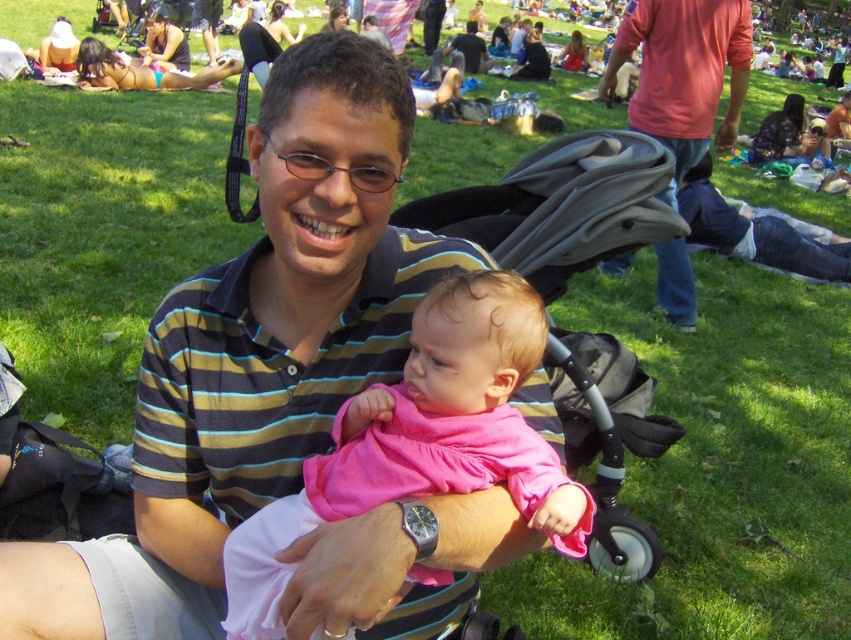
You need to place a small sticker on either the pink fabric baby at center or the matte pink shirt at upper right. Which object would you choose to ensure the sticker is visible without overlapping the other object?

The pink fabric baby at center has a larger width than the matte pink shirt at upper right, so placing the sticker on the pink fabric baby at center would ensure visibility without overlapping the matte pink shirt at upper right.

You are a photographer trying to capture a clear shot of the pink fabric baby at center and the matte pink shirt at upper right. Since the baby is closer to you, would you be able to focus on both objects simultaneously without adjusting your camera settings?

The pink fabric baby at center is in front of the matte pink shirt at upper right. Since the baby is closer, focusing on it would leave the matte pink shirt at upper right slightly out of focus unless the camera has a large depth of field.

You are a photographer trying to capture a closeup of the pink fabric baby at center and the matte pink shirt at upper right in the image. Based on their sizes, which object would require you to move closer to get a clear shot?

The pink fabric baby at center occupies less space than the matte pink shirt at upper right, so you would need to move closer to the pink fabric baby at center to capture it clearly in the closeup.